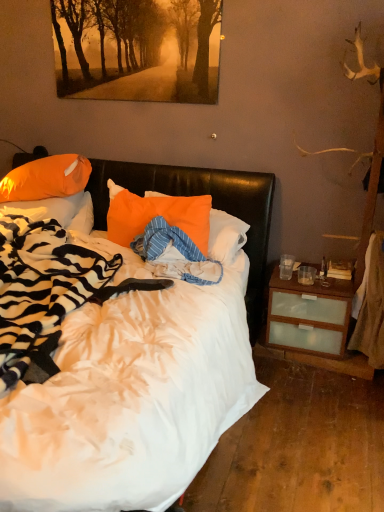
Question: Is orange glossy pillow at upper left, which is the second pillow in left-to-right order, positioned far away from orange fabric pillow at center, the first pillow when ordered from right to left?

Choices:
 (A) no
 (B) yes

Answer: (A)

Question: Considering the relative sizes of orange glossy pillow at upper left, acting as the 2th pillow starting from the right, and orange fabric pillow at center, the 3th pillow viewed from the left, in the image provided, is orange glossy pillow at upper left, acting as the 2th pillow starting from the right, thinner than orange fabric pillow at center, the 3th pillow viewed from the left,?

Choices:
 (A) yes
 (B) no

Answer: (B)

Question: Can you confirm if orange glossy pillow at upper left, acting as the 2th pillow starting from the right, is wider than orange fabric pillow at center, the first pillow when ordered from right to left?

Choices:
 (A) yes
 (B) no

Answer: (A)

Question: Can you confirm if orange glossy pillow at upper left, acting as the 2th pillow starting from the right, is shorter than orange fabric pillow at center, the first pillow when ordered from right to left?

Choices:
 (A) no
 (B) yes

Answer: (B)

Question: Can you confirm if orange glossy pillow at upper left, which is the second pillow in left-to-right order, is taller than orange fabric pillow at center, the 3th pillow viewed from the left?

Choices:
 (A) yes
 (B) no

Answer: (B)

Question: Visually, is orange fabric pillow at center, the first pillow when ordered from right to left, positioned to the left or to the right of orange glossy pillow at upper left, acting as the 2th pillow starting from the right?

Choices:
 (A) right
 (B) left

Answer: (A)

Question: In terms of width, does orange fabric pillow at center, the first pillow when ordered from right to left, look wider or thinner when compared to orange glossy pillow at upper left, which is the second pillow in left-to-right order?

Choices:
 (A) wide
 (B) thin

Answer: (B)

Question: Based on their sizes in the image, would you say orange fabric pillow at center, the 3th pillow viewed from the left, is bigger or smaller than orange glossy pillow at upper left, acting as the 2th pillow starting from the right?

Choices:
 (A) big
 (B) small

Answer: (B)

Question: Is point (163, 200) positioned closer to the camera than point (79, 183)?

Choices:
 (A) farther
 (B) closer

Answer: (B)

Question: Visually, is white soft bed at center positioned to the left or to the right of orange fabric pillow at left, positioned as the third pillow in right-to-left order?

Choices:
 (A) left
 (B) right

Answer: (B)

Question: In terms of width, does white soft bed at center look wider or thinner when compared to orange fabric pillow at left, positioned as the third pillow in right-to-left order?

Choices:
 (A) thin
 (B) wide

Answer: (B)

Question: Considering the positions of point (115, 372) and point (26, 207), is point (115, 372) closer or farther from the camera than point (26, 207)?

Choices:
 (A) closer
 (B) farther

Answer: (A)

Question: Would you say white soft bed at center is inside or outside orange fabric pillow at left, positioned as the third pillow in right-to-left order?

Choices:
 (A) inside
 (B) outside

Answer: (B)

Question: Considering their positions, is orange fabric pillow at center, the first pillow when ordered from right to left, located in front of or behind white soft bed at center?

Choices:
 (A) front
 (B) behind

Answer: (B)

Question: Would you say orange fabric pillow at center, the 3th pillow viewed from the left, is to the left or to the right of white soft bed at center in the picture?

Choices:
 (A) left
 (B) right

Answer: (B)